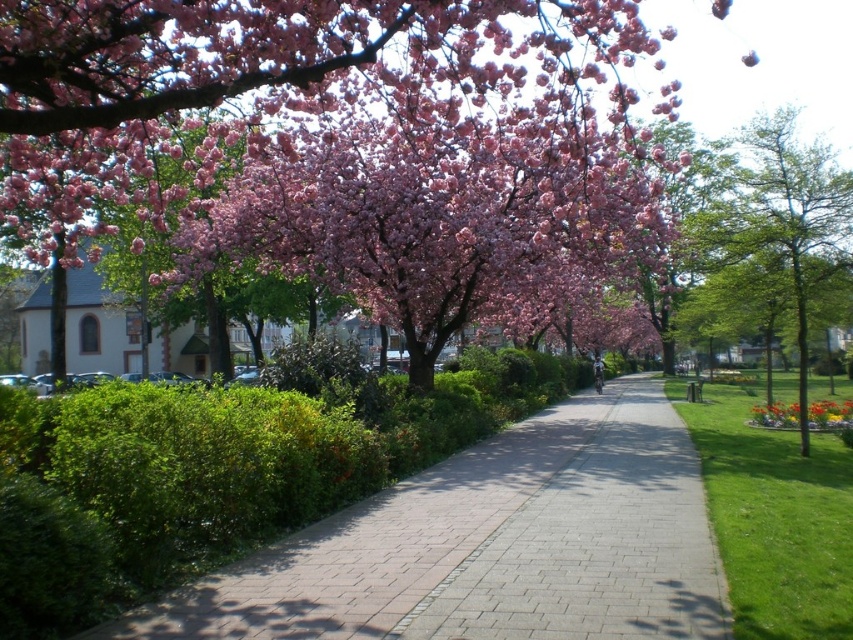
Question: Among these points, which one is farthest from the camera?

Choices:
 (A) (480, 634)
 (B) (833, 408)

Answer: (B)

Question: Based on their relative distances, which object is nearer to the pink blossoms at upper center?

Choices:
 (A) smooth concrete pavement at center
 (B) green leafy tree at right

Answer: (A)

Question: Which object is the farthest from the vibrant yellow flower at lower right?

Choices:
 (A) smooth concrete pavement at center
 (B) green leafy tree at right

Answer: (B)

Question: Is smooth concrete pavement at center bigger than vibrant yellow flower at lower right?

Choices:
 (A) yes
 (B) no

Answer: (B)

Question: Does pink blossoms at upper center have a greater width compared to vibrant yellow flower at lower right?

Choices:
 (A) yes
 (B) no

Answer: (B)

Question: Is pink blossoms at upper center behind vibrant yellow flower at lower right?

Choices:
 (A) no
 (B) yes

Answer: (A)